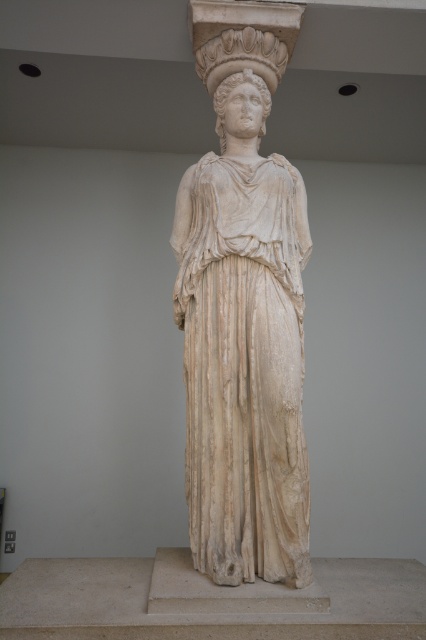
Question: Which point is closer to the camera?

Choices:
 (A) (184, 355)
 (B) (218, 115)

Answer: (A)

Question: Is white marble statue at center below white marble head at center?

Choices:
 (A) yes
 (B) no

Answer: (A)

Question: Is white marble statue at center positioned at the back of white marble head at center?

Choices:
 (A) no
 (B) yes

Answer: (A)

Question: Which object appears farthest from the camera in this image?

Choices:
 (A) white marble head at center
 (B) white marble statue at center

Answer: (A)

Question: Can you confirm if white marble statue at center is thinner than white marble head at center?

Choices:
 (A) yes
 (B) no

Answer: (B)

Question: Which point is closer to the camera?

Choices:
 (A) white marble statue at center
 (B) white marble head at center

Answer: (A)